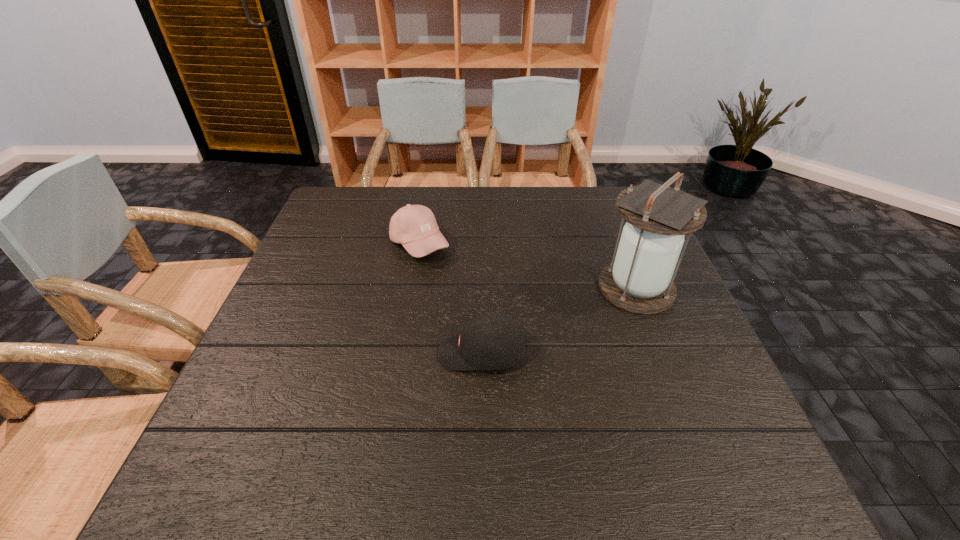
Find the location of `the rightmost object`. the rightmost object is located at coordinates (639, 280).

Locate an element on the screen. Image resolution: width=960 pixels, height=540 pixels. lantern is located at coordinates (639, 280).

Where is `the farther baseball cap`? The image size is (960, 540). the farther baseball cap is located at coordinates (414, 226).

Identify the location of the nearest object. (492, 341).

In order to click on vacant space situated on the left of the lantern in this screenshot , I will do `click(551, 288)`.

This screenshot has width=960, height=540. In order to click on free region located on the front-facing side of the farther baseball cap in this screenshot , I will do `click(468, 244)`.

At what (x,y) coordinates should I click in order to perform the action: click on vacant position located 0.400m with a logo on the front of the nearer baseball cap. Please return your answer as a coordinate pair (x, y). Looking at the image, I should click on (249, 353).

I want to click on vacant space situated with a logo on the front of the nearer baseball cap, so click(x=372, y=353).

Where is `vacant space located 0.190m with a logo on the front of the nearer baseball cap`? vacant space located 0.190m with a logo on the front of the nearer baseball cap is located at coordinates (348, 353).

Locate an element on the screen. Image resolution: width=960 pixels, height=540 pixels. object located in the far edge section of the desktop is located at coordinates (414, 226).